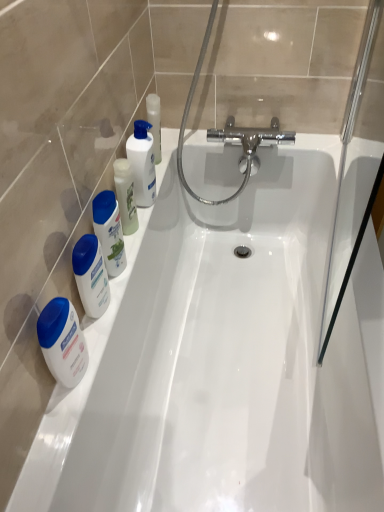
Question: From a real-world perspective, does white glossy bottle at upper left, the 2th cleaning product when ordered from left to right, stand above white glossy lotion at left, the 1th mouthwash positioned from the bottom?

Choices:
 (A) yes
 (B) no

Answer: (A)

Question: Is white glossy bottle at upper left, which ranks as the 2th cleaning product in front-to-back order, far from white glossy lotion at left, the 1th mouthwash positioned from the bottom?

Choices:
 (A) no
 (B) yes

Answer: (A)

Question: Would you say white glossy bottle at upper left, the 1th cleaning product from the right, is outside white glossy lotion at left, the 3th mouthwash viewed from the top?

Choices:
 (A) no
 (B) yes

Answer: (B)

Question: From the image's perspective, would you say white glossy bottle at upper left, the 1th cleaning product from the right, is positioned over white glossy lotion at left, the 3th mouthwash viewed from the top?

Choices:
 (A) yes
 (B) no

Answer: (A)

Question: Does white glossy bottle at upper left, placed as the first cleaning product when sorted from back to front, have a greater height compared to white glossy lotion at left, the 3th mouthwash viewed from the top?

Choices:
 (A) yes
 (B) no

Answer: (A)

Question: Is white glossy bottle at upper left, placed as the first cleaning product when sorted from back to front, wider than white glossy lotion at left, the 1th mouthwash positioned from the bottom?

Choices:
 (A) no
 (B) yes

Answer: (B)

Question: Does white glossy mouthwash at left, acting as the 2th mouthwash starting from the top, have a smaller size compared to white glossy mouthwash at left, placed as the 1th mouthwash when sorted from top to bottom?

Choices:
 (A) yes
 (B) no

Answer: (B)

Question: Is white glossy mouthwash at left, acting as the 2th mouthwash starting from the top, to the right of white glossy mouthwash at left, placed as the 1th mouthwash when sorted from top to bottom, from the viewer's perspective?

Choices:
 (A) yes
 (B) no

Answer: (B)

Question: Does white glossy mouthwash at left, which is the second mouthwash from bottom to top, turn towards white glossy mouthwash at left, placed as the 1th mouthwash when sorted from top to bottom?

Choices:
 (A) no
 (B) yes

Answer: (A)

Question: From a real-world perspective, is white glossy mouthwash at left, acting as the 2th mouthwash starting from the top, under white glossy mouthwash at left, positioned as the 3th mouthwash in bottom-to-top order?

Choices:
 (A) no
 (B) yes

Answer: (A)

Question: Is white glossy mouthwash at left, acting as the 2th mouthwash starting from the top, closer to the viewer compared to white glossy mouthwash at left, placed as the 1th mouthwash when sorted from top to bottom?

Choices:
 (A) no
 (B) yes

Answer: (B)

Question: Considering the relative sizes of white glossy mouthwash at left, which is the second mouthwash from bottom to top, and white glossy mouthwash at left, positioned as the 3th mouthwash in bottom-to-top order, in the image provided, is white glossy mouthwash at left, which is the second mouthwash from bottom to top, shorter than white glossy mouthwash at left, positioned as the 3th mouthwash in bottom-to-top order,?

Choices:
 (A) no
 (B) yes

Answer: (A)

Question: Does white glossy lotion at left, the 3th mouthwash viewed from the top, appear on the left side of white glossy mouthwash at left, acting as the 2th mouthwash starting from the top?

Choices:
 (A) yes
 (B) no

Answer: (A)